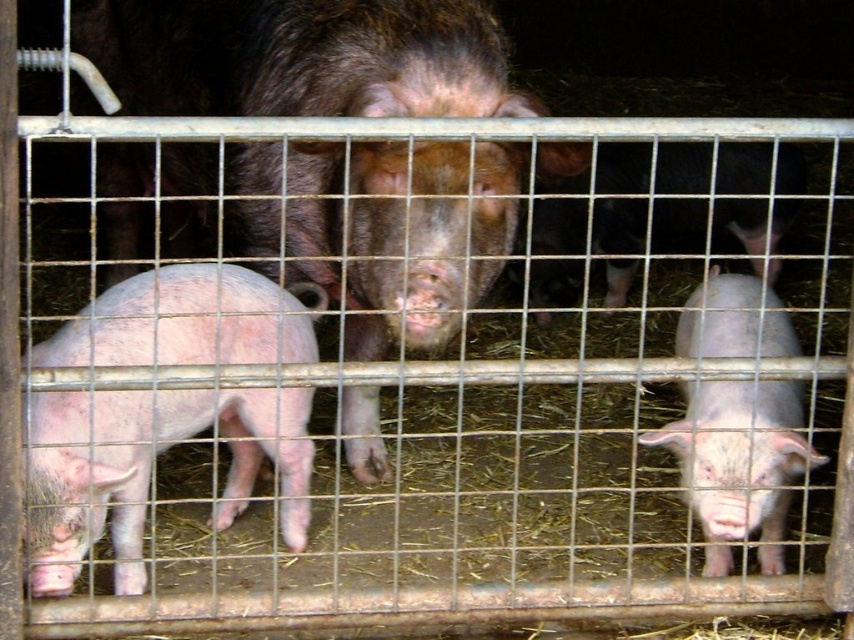
Between pink smooth pig at left and pink smooth piglet at right, which one appears on the left side from the viewer's perspective?

pink smooth pig at left is more to the left.

This screenshot has width=854, height=640. Identify the location of pink smooth pig at left. (147, 468).

Locate an element on the screen. pink smooth pig at left is located at coordinates pos(147,468).

Is brown matte pig at center closer to camera compared to pink smooth piglet at right?

Yes, brown matte pig at center is closer to the viewer.

Between point (475, 22) and point (681, 474), which one is positioned behind?

Point (681, 474)

You are a GUI agent. You are given a task and a screenshot of the screen. Output one action in this format:
    pyautogui.click(x=<x>, y=<y>)
    Task: Click on the brown matte pig at center
    
    Given the screenshot: What is the action you would take?
    pyautogui.click(x=393, y=232)

Between point (279, 97) and point (176, 394), which one is positioned behind?

The point (279, 97) is behind.

Consider the image. Between brown matte pig at center and pink smooth pig at left, which one is positioned higher?

brown matte pig at center

The height and width of the screenshot is (640, 854). What are the coordinates of `brown matte pig at center` in the screenshot? It's located at (393, 232).

This screenshot has width=854, height=640. I want to click on brown matte pig at center, so click(393, 232).